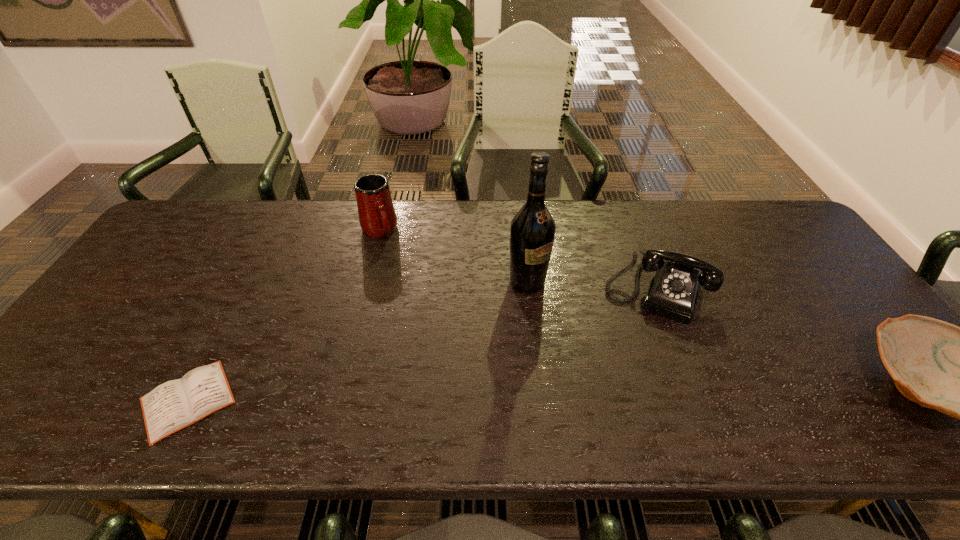
The width and height of the screenshot is (960, 540). In order to click on vacant space on the desktop that is between the diary and the fourth tallest object and is positioned on the dial of the second object from right to left in this screenshot , I will do `click(624, 392)`.

Where is `vacant space on the desktop that is between the diary and the fourth tallest object and is positioned on the label of the wine bottle`? This screenshot has width=960, height=540. vacant space on the desktop that is between the diary and the fourth tallest object and is positioned on the label of the wine bottle is located at coordinates (642, 392).

Where is `vacant space on the desktop that is between the leftmost object and the fourth tallest object and is positioned on the side of the mug with the handle`? vacant space on the desktop that is between the leftmost object and the fourth tallest object and is positioned on the side of the mug with the handle is located at coordinates (474, 395).